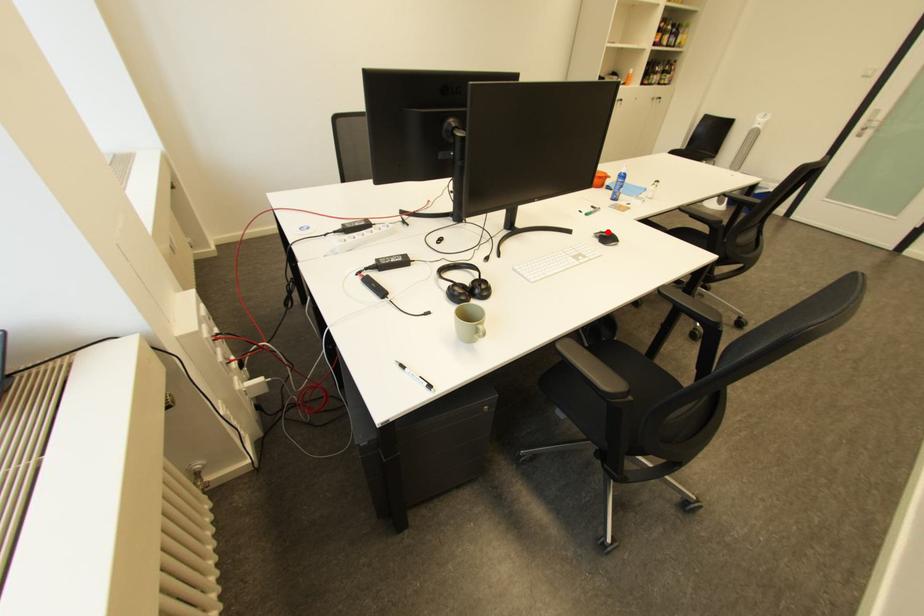
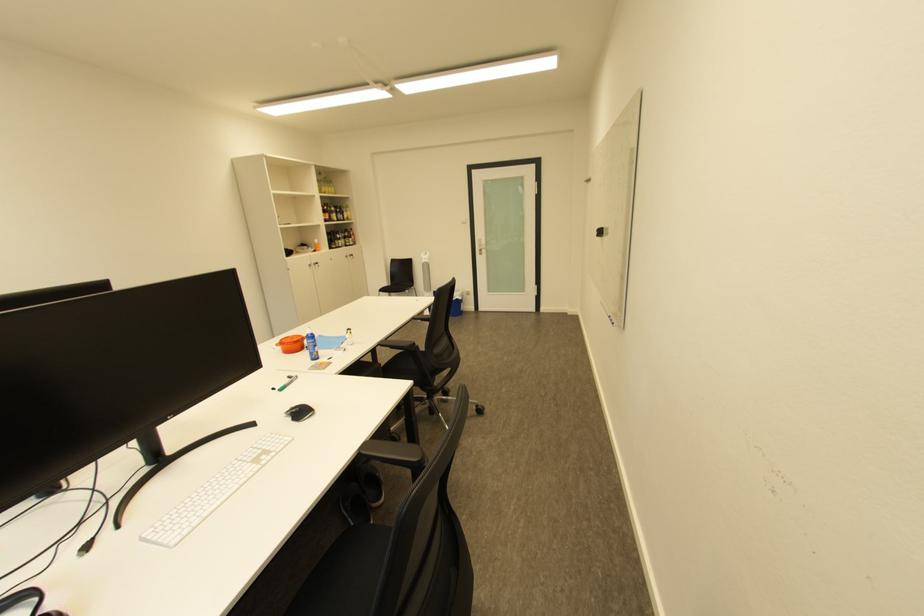
Where in the second image is the point corresponding to the highlighted location from the first image?

(298, 410)